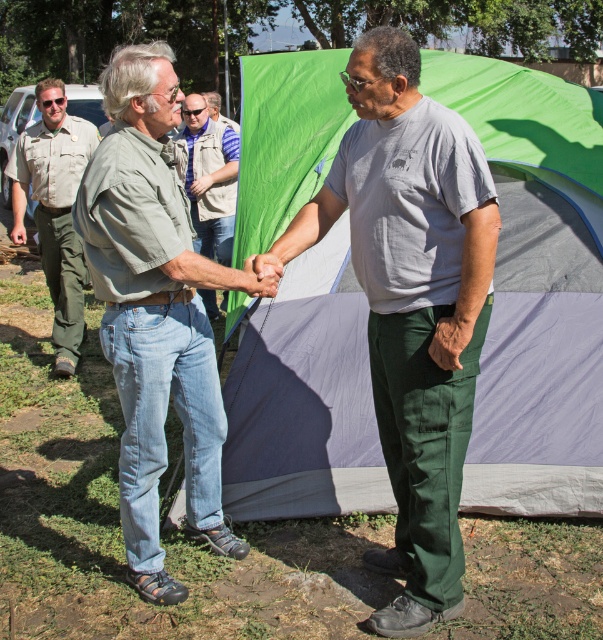
You are a photographer trying to capture a clear photo of the green denim jeans at center and the safari shirt at center. Since you want to focus on the taller object, which one should you adjust your camera to focus on?

The green denim jeans at center has a greater height compared to safari shirt at center, so you should adjust your camera to focus on the green denim jeans at center.

You are a photographer trying to capture a clear photo of the green denim jeans at center and the safari shirt at center. If you want to focus on the wider object, which one should you aim for?

The green denim jeans at center might be wider than safari shirt at center, so you should aim for the green denim jeans at center to focus on the wider object.